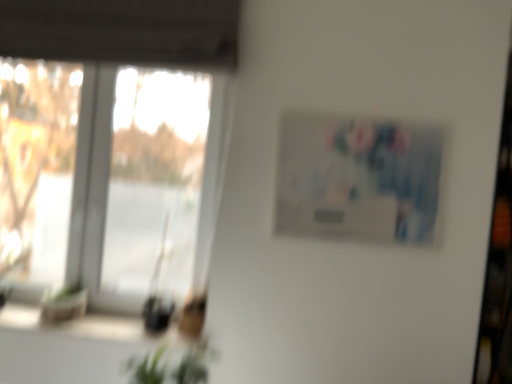
Question: In the image, is matte plastic picture frame at upper right positioned in front of or behind green leafy plant at lower center?

Choices:
 (A) behind
 (B) front

Answer: (A)

Question: Is matte plastic picture frame at upper right bigger or smaller than green leafy plant at lower center?

Choices:
 (A) small
 (B) big

Answer: (B)

Question: Which of these objects is positioned closest to the green leafy plant at lower left?

Choices:
 (A) transparent glass window at left
 (B) green leafy plant at lower center
 (C) matte plastic picture frame at upper right

Answer: (B)

Question: Which of these objects is positioned closest to the green leafy plant at lower left?

Choices:
 (A) green leafy plant at lower center
 (B) matte plastic picture frame at upper right
 (C) transparent glass window at left

Answer: (A)